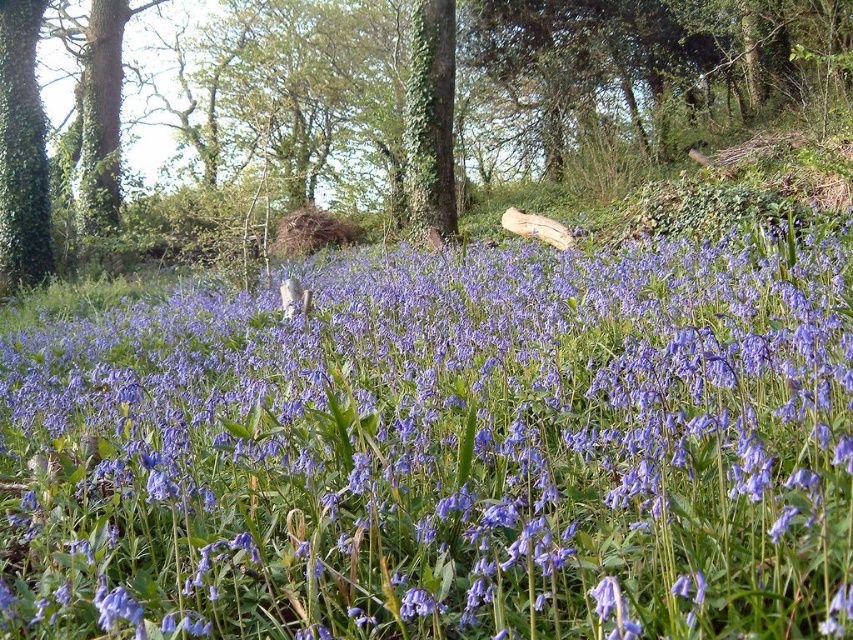
Question: Which point appears closest to the camera in this image?

Choices:
 (A) (51, 253)
 (B) (415, 198)

Answer: (B)

Question: Can you confirm if green leafy tree at center is smaller than green ivy-covered tree at center?

Choices:
 (A) no
 (B) yes

Answer: (A)

Question: Which of these objects is positioned closest to the green leafy tree at center?

Choices:
 (A) green ivy-covered tree at center
 (B) green ivy-covered tree at left
 (C) purple matte flower at center

Answer: (A)

Question: Based on their relative distances, which object is farther from the green ivy-covered tree at center?

Choices:
 (A) green leafy tree at center
 (B) green ivy-covered tree at left

Answer: (B)

Question: Is green ivy-covered tree at left to the left of green ivy-covered tree at center from the viewer's perspective?

Choices:
 (A) no
 (B) yes

Answer: (B)

Question: Considering the relative positions of green leafy tree at center and green ivy-covered tree at left in the image provided, where is green leafy tree at center located with respect to green ivy-covered tree at left?

Choices:
 (A) right
 (B) left

Answer: (A)